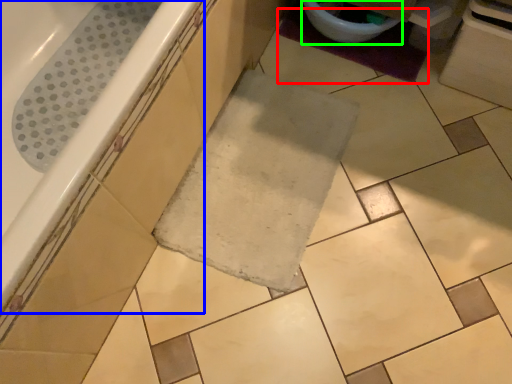
Question: Which is farther away from bath mat (highlighted by a red box)? bathtub (highlighted by a blue box) or toilet bowl (highlighted by a green box)?

Choices:
 (A) bathtub
 (B) toilet bowl

Answer: (A)